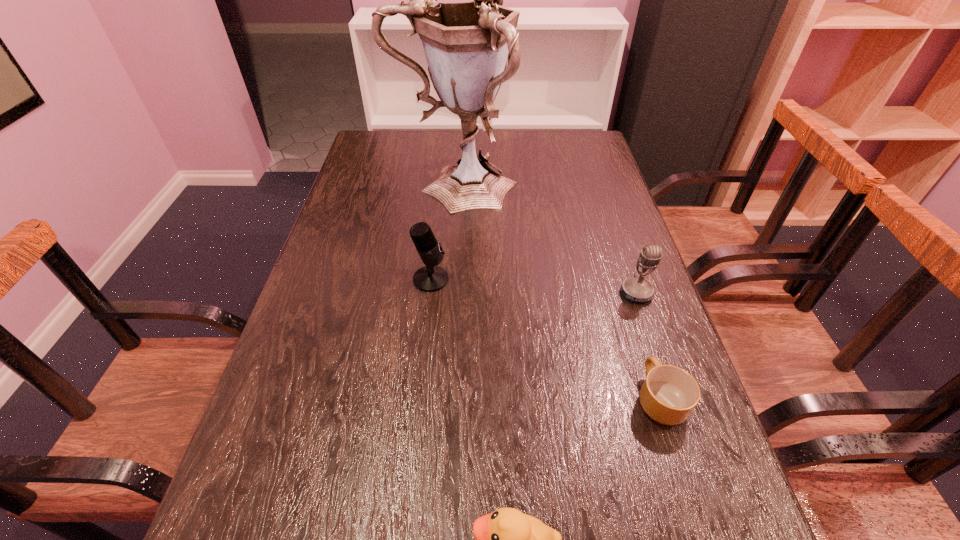
Locate an element on the screen. This screenshot has height=540, width=960. the tallest object is located at coordinates (466, 44).

Identify the location of trophy cup. The image size is (960, 540). (466, 44).

This screenshot has height=540, width=960. I want to click on the left microphone, so click(x=430, y=278).

I want to click on the right microphone, so click(635, 289).

This screenshot has width=960, height=540. What are the coordinates of `the shortest object` in the screenshot? It's located at (669, 394).

You are a GUI agent. You are given a task and a screenshot of the screen. Output one action in this format:
    pyautogui.click(x=<x>, y=<y>)
    Task: Click on the fourth farthest object
    This screenshot has height=540, width=960.
    Given the screenshot: What is the action you would take?
    pyautogui.click(x=669, y=394)

At what (x,y) coordinates should I click in order to perform the action: click on vacant region located on the left of the tallest object. Please return your answer as a coordinate pair (x, y). This screenshot has width=960, height=540. Looking at the image, I should click on (368, 186).

Locate an element on the screen. Image resolution: width=960 pixels, height=540 pixels. vacant space located on the stand of the left microphone is located at coordinates (556, 279).

At what (x,y) coordinates should I click in order to perform the action: click on vacant space located 0.400m on the front-facing side of the right microphone. Please return your answer as a coordinate pair (x, y). This screenshot has height=540, width=960. Looking at the image, I should click on (704, 488).

Where is `free space located on the side with the handle of the second nearest object`? Image resolution: width=960 pixels, height=540 pixels. free space located on the side with the handle of the second nearest object is located at coordinates (636, 328).